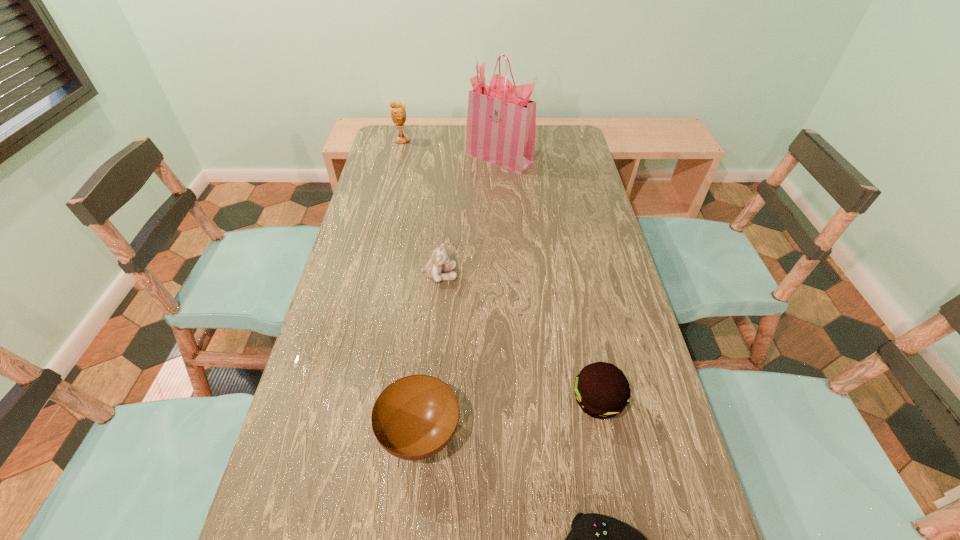
Identify the location of free area in between the patty and the fourth nearest object. (518, 338).

The height and width of the screenshot is (540, 960). I want to click on free space between the chalice and the teddy bear, so click(x=420, y=207).

The height and width of the screenshot is (540, 960). I want to click on vacant region between the chalice and the bowl, so click(411, 288).

Where is `unoccupied position between the shopping bag and the bowl`? Image resolution: width=960 pixels, height=540 pixels. unoccupied position between the shopping bag and the bowl is located at coordinates (460, 296).

The height and width of the screenshot is (540, 960). I want to click on free space between the fifth shortest object and the bowl, so click(411, 288).

Choose which object is the third nearest neighbor to the patty. Please provide its 2D coordinates. Your answer should be formatted as a tuple, i.e. [(x, y)], where the tuple contains the x and y coordinates of a point satisfying the conditions above.

[(438, 263)]

Find the location of a particular element. The image size is (960, 540). the fourth closest object to the tallest object is located at coordinates (415, 417).

Identify the location of blank area in the image that satisfies the following two spatial constraints: 1. on the face of the third farthest object; 2. on the front side of the bowl. This screenshot has width=960, height=540. (425, 435).

Locate an element on the screen. The image size is (960, 540). blank space that satisfies the following two spatial constraints: 1. on the front side of the tallest object; 2. on the face of the fourth nearest object is located at coordinates pos(507,275).

You are a GUI agent. You are given a task and a screenshot of the screen. Output one action in this format:
    pyautogui.click(x=<x>, y=<y>)
    Task: Click on the free space in the image that satisfies the following two spatial constraints: 1. on the back side of the tallest object; 2. on the left side of the bowl
    This screenshot has height=540, width=960.
    Given the screenshot: What is the action you would take?
    pyautogui.click(x=447, y=157)